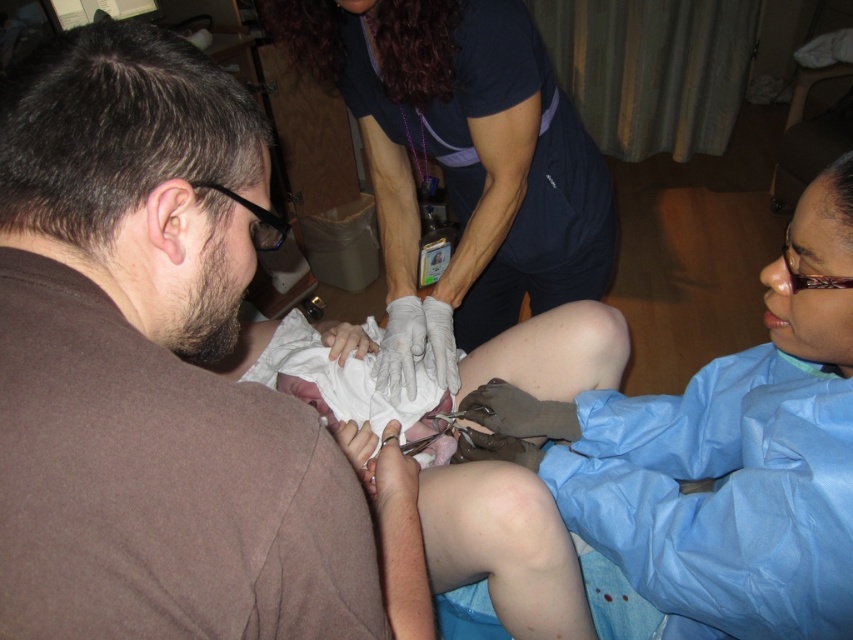
Consider the image. Is blue latex gloves at upper center to the left of matte blue scrubs at center from the viewer's perspective?

Correct, you'll find blue latex gloves at upper center to the left of matte blue scrubs at center.

Does point (77, 284) come in front of point (312, 64)?

That is True.

Where is `blue latex gloves at upper center`? blue latex gloves at upper center is located at coordinates (161, 376).